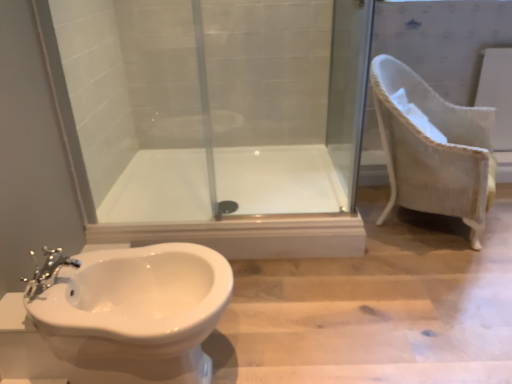
In order to face white woven armchair at right, should I rotate leftwards or rightwards?

Rotate right and turn 22.411 degrees.

What do you see at coordinates (348, 88) in the screenshot? I see `transparent glass screen door at center` at bounding box center [348, 88].

The width and height of the screenshot is (512, 384). I want to click on transparent glass screen door at center, so click(348, 88).

Locate an element on the screen. The height and width of the screenshot is (384, 512). white glossy toilet at lower left is located at coordinates (133, 312).

Is white glossy bath at center oriented away from white woven armchair at right?

white glossy bath at center is not turned away from white woven armchair at right.

The height and width of the screenshot is (384, 512). Identify the location of bath below the white woven armchair at right (from the image's perspective). (278, 179).

Is white glossy bath at center at the left side of white woven armchair at right?

Yes, white glossy bath at center is to the left of white woven armchair at right.

From a real-world perspective, is transparent glass screen door at center located higher than white woven armchair at right?

Yes.

Considering the sizes of objects transparent glass screen door at center and white woven armchair at right in the image provided, who is wider, transparent glass screen door at center or white woven armchair at right?

white woven armchair at right.

Is transparent glass screen door at center facing away from white woven armchair at right?

Yes, white woven armchair at right is at the back of transparent glass screen door at center.

Is chrome metallic faucet at lower left positioned beyond the bounds of white glossy toilet at lower left?

Actually, chrome metallic faucet at lower left is at least partially inside white glossy toilet at lower left.

Is chrome metallic faucet at lower left positioned behind white glossy toilet at lower left?

Yes, it is behind white glossy toilet at lower left.

Find the location of `tap above the white glossy toilet at lower left (from a real-world perspective)`. tap above the white glossy toilet at lower left (from a real-world perspective) is located at coordinates (47, 272).

What's the angular difference between chrome metallic faucet at lower left and white glossy toilet at lower left's facing directions?

They differ by 0.00154 degrees in their facing directions.

Between white glossy toilet at lower left and chrome metallic faucet at lower left, which one has larger width?

white glossy toilet at lower left.

In order to click on toilet that is on the right side of chrome metallic faucet at lower left in this screenshot , I will do `click(133, 312)`.

Considering the positions of objects white glossy toilet at lower left and chrome metallic faucet at lower left in the image provided, who is more to the left, white glossy toilet at lower left or chrome metallic faucet at lower left?

chrome metallic faucet at lower left.

From a real-world perspective, is white glossy toilet at lower left on chrome metallic faucet at lower left?

No, from a real-world perspective, white glossy toilet at lower left is not above chrome metallic faucet at lower left.

Would you say white woven armchair at right is inside or outside chrome metallic faucet at lower left?

white woven armchair at right is not inside chrome metallic faucet at lower left, it's outside.

From the image's perspective, which one is positioned higher, white woven armchair at right or chrome metallic faucet at lower left?

white woven armchair at right, from the image's perspective.

Is white woven armchair at right to the left or to the right of chrome metallic faucet at lower left in the image?

white woven armchair at right is to the right of chrome metallic faucet at lower left.

Is the position of white woven armchair at right more distant than that of chrome metallic faucet at lower left?

Yes, white woven armchair at right is behind chrome metallic faucet at lower left.

Does white glossy toilet at lower left have a greater height compared to white woven armchair at right?

In fact, white glossy toilet at lower left may be shorter than white woven armchair at right.

What's the angular difference between white glossy toilet at lower left and white woven armchair at right's facing directions?

28.7 degrees.

Considering the points (128, 347) and (473, 110), which point is in front, point (128, 347) or point (473, 110)?

Point (128, 347)

Can you confirm if white glossy toilet at lower left is thinner than white woven armchair at right?

Yes, white glossy toilet at lower left is thinner than white woven armchair at right.

Does white woven armchair at right appear on the right side of transparent glass screen door at center?

Indeed, white woven armchair at right is positioned on the right side of transparent glass screen door at center.

From their relative heights in the image, would you say white woven armchair at right is taller or shorter than transparent glass screen door at center?

Considering their sizes, white woven armchair at right has less height than transparent glass screen door at center.

From the image's perspective, is white woven armchair at right located beneath transparent glass screen door at center?

Indeed, from the image's perspective, white woven armchair at right is shown beneath transparent glass screen door at center.

Does white woven armchair at right have a smaller size compared to transparent glass screen door at center?

Actually, white woven armchair at right might be larger than transparent glass screen door at center.

Locate an element on the screen. bath on the left of white woven armchair at right is located at coordinates (278, 179).

Find the location of a particular element. screen door above the white woven armchair at right (from the image's perspective) is located at coordinates (348, 88).

Which object lies further to the anchor point white glossy bath at center, transparent glass screen door at center or white woven armchair at right?

white woven armchair at right.

Considering their positions, is white glossy toilet at lower left positioned closer to chrome metallic faucet at lower left than white woven armchair at right?

Based on the image, white glossy toilet at lower left appears to be nearer to chrome metallic faucet at lower left.

Based on their spatial positions, is chrome metallic faucet at lower left or white woven armchair at right further from white glossy toilet at lower left?

white woven armchair at right lies further to white glossy toilet at lower left than the other object.

Looking at the image, which one is located further to transparent glass screen door at center, white woven armchair at right or white glossy bath at center?

white glossy bath at center.

Considering their positions, is white glossy bath at center positioned further to white woven armchair at right than transparent glass screen door at center?

Among the two, white glossy bath at center is located further to white woven armchair at right.

From the image, which object appears to be farther from white glossy bath at center, transparent glass screen door at center or white glossy toilet at lower left?

white glossy toilet at lower left is positioned further to the anchor white glossy bath at center.

Based on their spatial positions, is white glossy toilet at lower left or chrome metallic faucet at lower left closer to white woven armchair at right?

The object closer to white woven armchair at right is white glossy toilet at lower left.

Looking at the image, which one is located further to chrome metallic faucet at lower left, white glossy toilet at lower left or white glossy bath at center?

white glossy bath at center.

Locate an element on the screen. This screenshot has height=384, width=512. bath located between chrome metallic faucet at lower left and white woven armchair at right in the left-right direction is located at coordinates (278, 179).

You are a GUI agent. You are given a task and a screenshot of the screen. Output one action in this format:
    pyautogui.click(x=<x>, y=<y>)
    Task: Click on the bath between chrome metallic faucet at lower left and transparent glass screen door at center in the horizontal direction
    
    Given the screenshot: What is the action you would take?
    pyautogui.click(x=278, y=179)

Where is `screen door situated between chrome metallic faucet at lower left and white woven armchair at right from left to right`? Image resolution: width=512 pixels, height=384 pixels. screen door situated between chrome metallic faucet at lower left and white woven armchair at right from left to right is located at coordinates (348, 88).

The image size is (512, 384). I want to click on screen door between white glossy toilet at lower left and white glossy bath at center along the z-axis, so click(x=348, y=88).